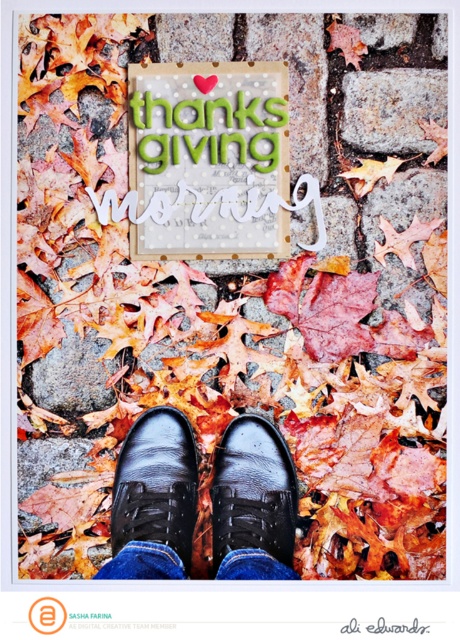
Question: Which of these objects is positioned farthest from the glossy leather shoe at center?

Choices:
 (A) matte cardboard sign at center
 (B) black leather shoes at center
 (C) black leather shoe at center

Answer: (A)

Question: Which point is closer to the camera taking this photo?

Choices:
 (A) (201, 177)
 (B) (245, 477)
 (C) (196, 474)

Answer: (B)

Question: Is black leather shoes at center positioned at the back of glossy leather shoe at center?

Choices:
 (A) yes
 (B) no

Answer: (B)

Question: Does black leather shoes at center have a greater width compared to black leather shoe at center?

Choices:
 (A) no
 (B) yes

Answer: (B)

Question: Considering the real-world distances, which object is closest to the black leather shoes at center?

Choices:
 (A) glossy leather shoe at center
 (B) matte cardboard sign at center

Answer: (A)

Question: Is matte cardboard sign at center smaller than black leather shoe at center?

Choices:
 (A) yes
 (B) no

Answer: (B)